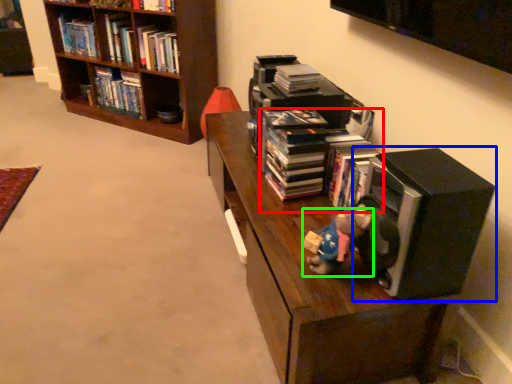
Question: Which is farther away from book (highlighted by a red box)? speaker (highlighted by a blue box) or figurine (highlighted by a green box)?

Choices:
 (A) speaker
 (B) figurine

Answer: (B)